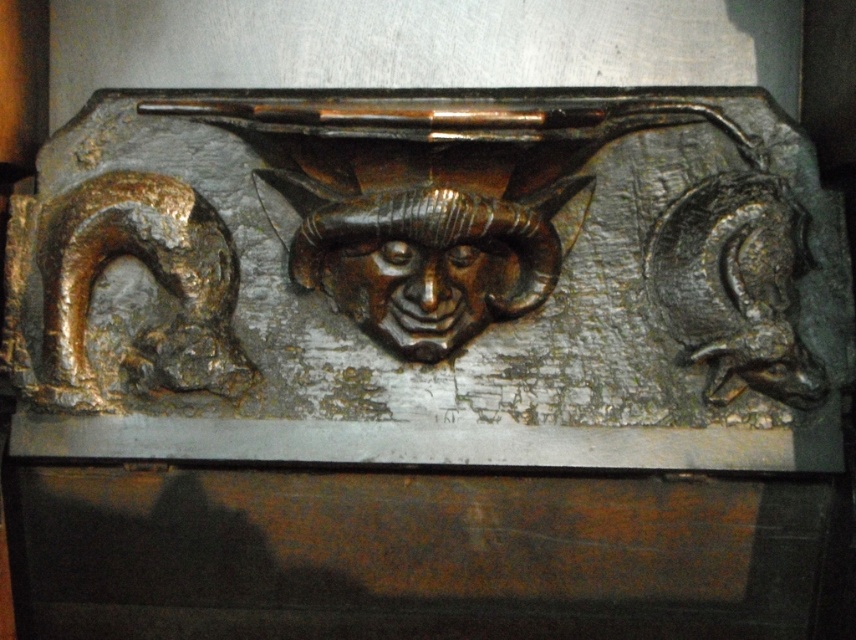
Question: Which point is closer to the camera?

Choices:
 (A) bronze textured face at center
 (B) bronze textured mask at center

Answer: (B)

Question: Can you confirm if bronze textured face at center is bigger than shiny bronze mask at center?

Choices:
 (A) yes
 (B) no

Answer: (A)

Question: Is bronze textured mask at center above shiny bronze mask at center?

Choices:
 (A) no
 (B) yes

Answer: (B)

Question: Among these points, which one is farthest from the camera?

Choices:
 (A) (235, 321)
 (B) (421, 340)

Answer: (A)

Question: Can you confirm if bronze textured mask at center is positioned to the right of shiny bronze mask at center?

Choices:
 (A) yes
 (B) no

Answer: (A)

Question: Which point is farther to the camera?

Choices:
 (A) (376, 269)
 (B) (412, 312)

Answer: (B)